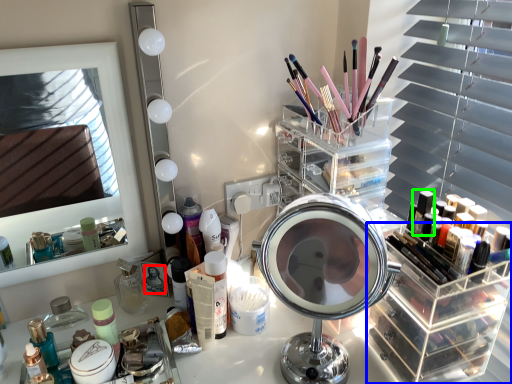
Question: Considering the real-world distances, which object is farthest from makeup artist (highlighted by a red box)? shelf (highlighted by a blue box) or toiletry (highlighted by a green box)?

Choices:
 (A) shelf
 (B) toiletry

Answer: (B)